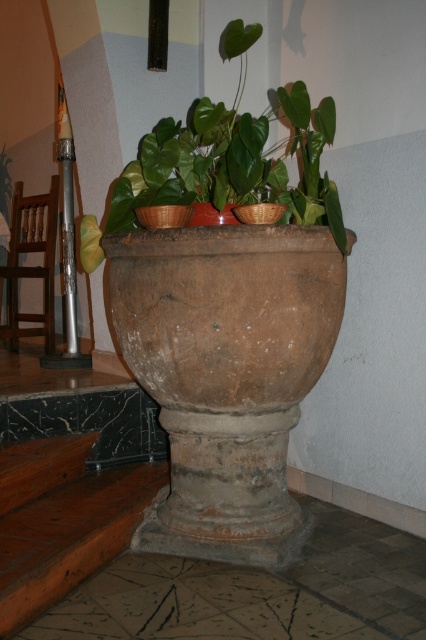
You are arranging flowers for a party and need to place a bouquet in the correct container. You have two options in the image, the brown earthenware vase at center and the brown textured pot at center. According to their positions, which one is on the left side?

The brown earthenware vase at center is positioned to the left of the brown textured pot at center, so the brown earthenware vase at center is on the left side.

You are standing in the room and want to place a small decoration on the brown earthenware vase at center and the brown textured pot at center. Which one can you reach without moving closer?

The brown earthenware vase at center is closer to you, so you can reach it without moving closer, but the brown textured pot at center is further away and requires moving closer to reach.

Based on the photo, you are arranging flowers in a room and see the brown earthenware vase at center and the brown textured pot at center. Which one should you place higher to avoid water dripping from the pot onto the vase?

The brown textured pot at center should be placed higher than the brown earthenware vase at center to prevent water from dripping onto it since the brown earthenware vase at center is currently positioned under the brown textured pot at center.